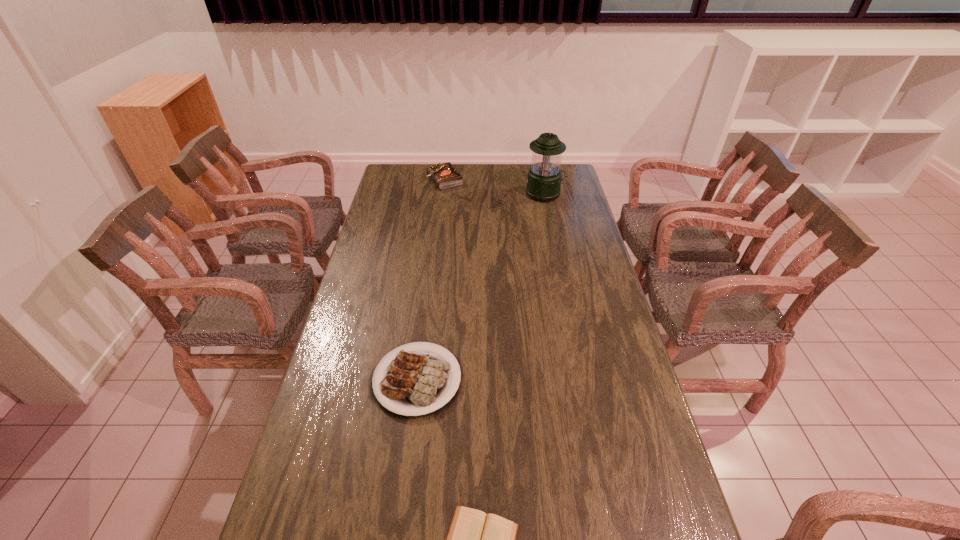
Where is `diary present at the far edge`? The image size is (960, 540). diary present at the far edge is located at coordinates (445, 175).

At what (x,y) coordinates should I click in order to perform the action: click on object located at the left edge. Please return your answer as a coordinate pair (x, y). Looking at the image, I should click on (416, 382).

Find the location of `object that is at the right edge`. object that is at the right edge is located at coordinates (544, 177).

Locate an element on the screen. The height and width of the screenshot is (540, 960). object situated at the far right corner is located at coordinates (544, 177).

The image size is (960, 540). In the image, there is a desktop. Find the location of `vacant space at the far edge`. vacant space at the far edge is located at coordinates (510, 177).

Where is `free space at the left edge of the desktop`? Image resolution: width=960 pixels, height=540 pixels. free space at the left edge of the desktop is located at coordinates (347, 314).

Image resolution: width=960 pixels, height=540 pixels. Find the location of `vacant position at the right edge of the desktop`. vacant position at the right edge of the desktop is located at coordinates (620, 504).

Identify the location of empty location between the rightmost object and the third tallest object. This screenshot has width=960, height=540. tap(481, 287).

Where is `free space between the plate and the taller diary`? Image resolution: width=960 pixels, height=540 pixels. free space between the plate and the taller diary is located at coordinates (431, 280).

Locate an element on the screen. Image resolution: width=960 pixels, height=540 pixels. free space between the rightmost object and the third shortest object is located at coordinates point(494,187).